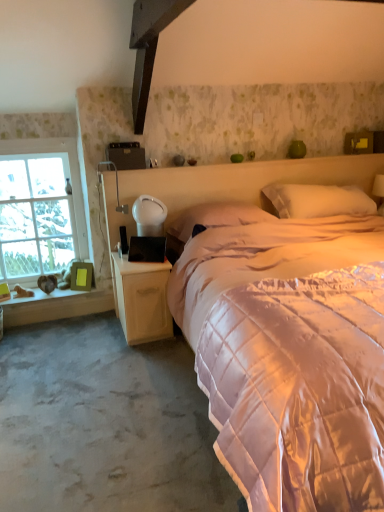
What is the approximate height of wooden nightstand at lower left?

The height of wooden nightstand at lower left is 20.90 inches.

This screenshot has width=384, height=512. What do you see at coordinates (142, 298) in the screenshot?
I see `wooden nightstand at lower left` at bounding box center [142, 298].

Where is `white quilted pillow at upper center, the second pillow in the left-to-right sequence`? The width and height of the screenshot is (384, 512). white quilted pillow at upper center, the second pillow in the left-to-right sequence is located at coordinates (315, 200).

Image resolution: width=384 pixels, height=512 pixels. What do you see at coordinates (291, 356) in the screenshot? I see `lavender quilted bed at center` at bounding box center [291, 356].

Find the location of a particular element. clear glass window at left is located at coordinates (39, 208).

Locate an element on the screen. The width and height of the screenshot is (384, 512). woodenwoodenwindow sill at left is located at coordinates (64, 298).

Can you tell me how much white quilted pillow at upper center, the first pillow in the right-to-left sequence, and gray carpet at lower left differ in facing direction?

They differ by 0.000162 degrees in their facing directions.

Considering the points (265, 200) and (128, 368), which point is behind, point (265, 200) or point (128, 368)?

Point (265, 200)

From a real-world perspective, which is physically below, white quilted pillow at upper center, the second pillow in the left-to-right sequence, or gray carpet at lower left?

gray carpet at lower left, from a real-world perspective.

Consider the image. From a real-world perspective, is white glossy table lamp at lower left, placed as the 1th table lamp when sorted from right to left, located higher than silky white pillow at center, the first pillow in the left-to-right sequence?

Yes, from a real-world perspective, white glossy table lamp at lower left, placed as the 1th table lamp when sorted from right to left, is over silky white pillow at center, the first pillow in the left-to-right sequence

Which is more to the right, white glossy table lamp at lower left, which appears as the 2th table lamp when viewed from the left, or silky white pillow at center, which appears as the 2th pillow when viewed from the right?

silky white pillow at center, which appears as the 2th pillow when viewed from the right, is more to the right.

Who is shorter, white glossy table lamp at lower left, placed as the 1th table lamp when sorted from right to left, or silky white pillow at center, the first pillow in the left-to-right sequence?

With less height is silky white pillow at center, the first pillow in the left-to-right sequence.

Which is in front, point (60, 449) or point (157, 220)?

The point (60, 449) is more forward.

From the image's perspective, is gray carpet at lower left on top of white glossy table lamp at lower left, which appears as the 2th table lamp when viewed from the left?

No, from the image's perspective, gray carpet at lower left is not over white glossy table lamp at lower left, which appears as the 2th table lamp when viewed from the left.

Does gray carpet at lower left have a greater width compared to white glossy table lamp at lower left, which appears as the 2th table lamp when viewed from the left?

Yes.

Does gray carpet at lower left have a lesser height compared to white glossy table lamp at lower left, placed as the 1th table lamp when sorted from right to left?

Correct, gray carpet at lower left is not as tall as white glossy table lamp at lower left, placed as the 1th table lamp when sorted from right to left.

Choose the correct answer: Is woodenwoodenwindow sill at left inside lavender quilted bed at center or outside it?

woodenwoodenwindow sill at left exists outside the volume of lavender quilted bed at center.

Find the location of a particular element. This screenshot has width=384, height=512. window sill lying on the left of lavender quilted bed at center is located at coordinates (64, 298).

From the image's perspective, who appears lower, woodenwoodenwindow sill at left or lavender quilted bed at center?

From the image's view, woodenwoodenwindow sill at left is below.

Which point is more forward, (37, 288) or (379, 229)?

The point (379, 229) is closer to the camera.

Is white glossy table lamp at lower left, placed as the 1th table lamp when sorted from right to left, at the back of matte white table lamp at left, which is the second table lamp in right-to-left order?

No, matte white table lamp at left, which is the second table lamp in right-to-left order,'s orientation is not away from white glossy table lamp at lower left, placed as the 1th table lamp when sorted from right to left.

How many degrees apart are the facing directions of matte white table lamp at left, positioned as the 1th table lamp in left-to-right order, and white glossy table lamp at lower left, placed as the 1th table lamp when sorted from right to left?

The angle between the facing direction of matte white table lamp at left, positioned as the 1th table lamp in left-to-right order, and the facing direction of white glossy table lamp at lower left, placed as the 1th table lamp when sorted from right to left, is 36.8 degrees.

Which is more to the right, matte white table lamp at left, which is the second table lamp in right-to-left order, or white glossy table lamp at lower left, placed as the 1th table lamp when sorted from right to left?

white glossy table lamp at lower left, placed as the 1th table lamp when sorted from right to left.

Considering the relative sizes of matte white table lamp at left, positioned as the 1th table lamp in left-to-right order, and white glossy table lamp at lower left, which appears as the 2th table lamp when viewed from the left, in the image provided, is matte white table lamp at left, positioned as the 1th table lamp in left-to-right order, wider than white glossy table lamp at lower left, which appears as the 2th table lamp when viewed from the left,?

Yes.

Would you say wooden nightstand at lower left is a long distance from white quilted pillow at upper center, the second pillow in the left-to-right sequence?

Yes.

From a real-world perspective, is wooden nightstand at lower left beneath white quilted pillow at upper center, the first pillow in the right-to-left sequence?

Yes, from a real-world perspective, wooden nightstand at lower left is under white quilted pillow at upper center, the first pillow in the right-to-left sequence.

Considering the relative sizes of wooden nightstand at lower left and white quilted pillow at upper center, the second pillow in the left-to-right sequence, in the image provided, is wooden nightstand at lower left taller than white quilted pillow at upper center, the second pillow in the left-to-right sequence,?

Yes.

Considering the positions of objects clear glass window at left and silky white pillow at center, the first pillow in the left-to-right sequence, in the image provided, who is behind, clear glass window at left or silky white pillow at center, the first pillow in the left-to-right sequence,?

clear glass window at left is more distant.

Is point (75, 166) more distant than point (225, 216)?

Yes, it is.

Where is `window positioned vertically above the silky white pillow at center, the first pillow in the left-to-right sequence (from a real-world perspective)`? This screenshot has width=384, height=512. window positioned vertically above the silky white pillow at center, the first pillow in the left-to-right sequence (from a real-world perspective) is located at coordinates (39, 208).

Consider the image. Can you tell me how much clear glass window at left and silky white pillow at center, the first pillow in the left-to-right sequence, differ in facing direction?

The facing directions of clear glass window at left and silky white pillow at center, the first pillow in the left-to-right sequence, are 0.000685 degrees apart.

Which pillow is the 2nd one when counting from the back of the gray carpet at lower left? Please provide its 2D coordinates.

[(315, 200)]

From a real-world perspective, starting from the silky white pillow at center, which appears as the 2th pillow when viewed from the right, which table lamp is the 1st one vertically above it? Please provide its 2D coordinates.

[(149, 215)]

Which object lies nearer to the anchor point matte white table lamp at left, which is the second table lamp in right-to-left order, silky white pillow at center, the first pillow in the left-to-right sequence, or gray carpet at lower left?

silky white pillow at center, the first pillow in the left-to-right sequence, is positioned closer to the anchor matte white table lamp at left, which is the second table lamp in right-to-left order.

Based on the photo, estimate the real-world distances between objects in this image. Which object is closer to white quilted pillow at upper center, the second pillow in the left-to-right sequence, clear glass window at left or gray carpet at lower left?

gray carpet at lower left.

Looking at the image, which one is located closer to wooden nightstand at lower left, white quilted pillow at upper center, the first pillow in the right-to-left sequence, or white glossy table lamp at lower left, which appears as the 2th table lamp when viewed from the left?

white glossy table lamp at lower left, which appears as the 2th table lamp when viewed from the left, lies closer to wooden nightstand at lower left than the other object.

Based on their spatial positions, is silky white pillow at center, which appears as the 2th pillow when viewed from the right, or clear glass window at left further from woodenwoodenwindow sill at left?

silky white pillow at center, which appears as the 2th pillow when viewed from the right, is positioned further to the anchor woodenwoodenwindow sill at left.

When comparing their distances from gray carpet at lower left, does woodenwoodenwindow sill at left or white quilted pillow at upper center, the second pillow in the left-to-right sequence, seem closer?

woodenwoodenwindow sill at left.

From the picture: Which object lies nearer to the anchor point woodenwoodenwindow sill at left, gray carpet at lower left or silky white pillow at center, which appears as the 2th pillow when viewed from the right?

Based on the image, silky white pillow at center, which appears as the 2th pillow when viewed from the right, appears to be nearer to woodenwoodenwindow sill at left.

Looking at the image, which one is located closer to white glossy table lamp at lower left, placed as the 1th table lamp when sorted from right to left, white quilted pillow at upper center, the first pillow in the right-to-left sequence, or clear glass window at left?

clear glass window at left is positioned closer to the anchor white glossy table lamp at lower left, placed as the 1th table lamp when sorted from right to left.

Looking at the image, which one is located closer to matte white table lamp at left, positioned as the 1th table lamp in left-to-right order, lavender quilted bed at center or woodenwoodenwindow sill at left?

woodenwoodenwindow sill at left is positioned closer to the anchor matte white table lamp at left, positioned as the 1th table lamp in left-to-right order.

Find the location of `nightstand located between lavender quilted bed at center and clear glass window at left in the depth direction`. nightstand located between lavender quilted bed at center and clear glass window at left in the depth direction is located at coordinates (142, 298).

You are a GUI agent. You are given a task and a screenshot of the screen. Output one action in this format:
    pyautogui.click(x=<x>, y=<y>)
    Task: Click on the table lamp between matte white table lamp at left, which is the second table lamp in right-to-left order, and white quilted pillow at upper center, the first pillow in the right-to-left sequence, in the horizontal direction
    This screenshot has height=512, width=384.
    Given the screenshot: What is the action you would take?
    pyautogui.click(x=149, y=215)

Image resolution: width=384 pixels, height=512 pixels. I want to click on table lamp between matte white table lamp at left, positioned as the 1th table lamp in left-to-right order, and silky white pillow at center, which appears as the 2th pillow when viewed from the right, from left to right, so click(x=149, y=215).

Identify the location of table lamp situated between clear glass window at left and white glossy table lamp at lower left, placed as the 1th table lamp when sorted from right to left, from left to right. (116, 185).